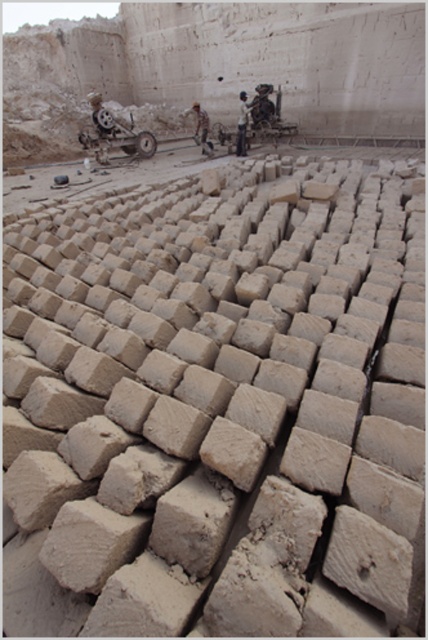
Question: Can you confirm if light brown clay bricks at center is wider than light brown leather jacket at center?

Choices:
 (A) no
 (B) yes

Answer: (A)

Question: Does metallic silver motorbike at upper left have a smaller size compared to light brown clay bricks at center?

Choices:
 (A) yes
 (B) no

Answer: (B)

Question: Which point is closer to the camera?

Choices:
 (A) (205, 147)
 (B) (77, 134)
 (C) (243, 136)

Answer: (C)

Question: Which object appears farthest from the camera in this image?

Choices:
 (A) metallic silver motorbike at upper left
 (B) light brown leather jacket at center
 (C) light brown clay bricks at center

Answer: (C)

Question: Based on their relative distances, which object is nearer to the light brown clay bricks at center?

Choices:
 (A) metallic silver motorbike at upper left
 (B) light brown leather jacket at center

Answer: (B)

Question: Does metallic silver motorbike at upper left have a smaller size compared to light brown clay bricks at center?

Choices:
 (A) no
 (B) yes

Answer: (A)